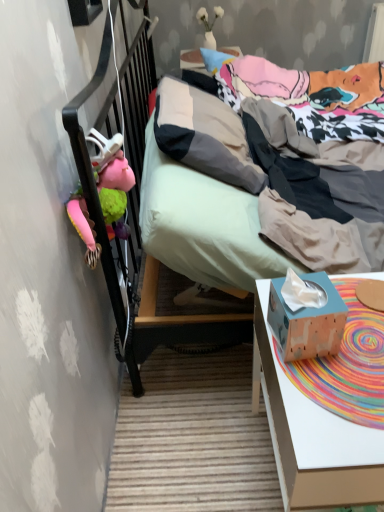
Question: Considering the positions of wooden tissue box at lower right and white matte vase at upper center, which ranks as the second toy in left-to-right order, in the image, is wooden tissue box at lower right wider or thinner than white matte vase at upper center, which ranks as the second toy in left-to-right order,?

Choices:
 (A) thin
 (B) wide

Answer: (A)

Question: Considering their positions, is wooden tissue box at lower right located in front of or behind white matte vase at upper center, the second toy viewed from the front?

Choices:
 (A) behind
 (B) front

Answer: (B)

Question: Which of these objects is positioned farthest from the pink fabric stuffed animal at left, the second toy when ordered from back to front?

Choices:
 (A) wooden tissue box at right
 (B) wooden tissue box at lower right
 (C) white matte vase at upper center, the second toy viewed from the front
 (D) textured cotton bed at center

Answer: (C)

Question: Which object is the farthest from the pink fabric stuffed animal at left, marked as the second toy in a top-to-bottom arrangement?

Choices:
 (A) white matte vase at upper center, which ranks as the 2th toy in bottom-to-top order
 (B) wooden tissue box at lower right
 (C) textured cotton bed at center
 (D) wooden tissue box at right

Answer: (A)